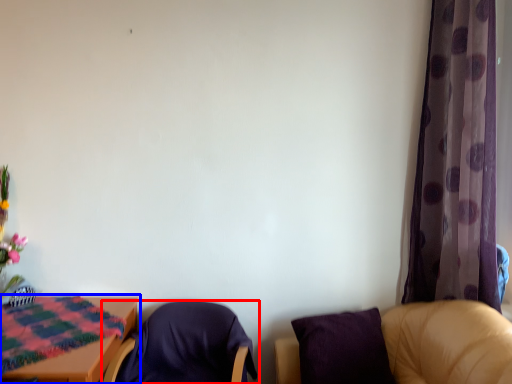
Question: Which of the following is the farthest to the observer, chair (highlighted by a red box) or table (highlighted by a blue box)?

Choices:
 (A) chair
 (B) table

Answer: (A)